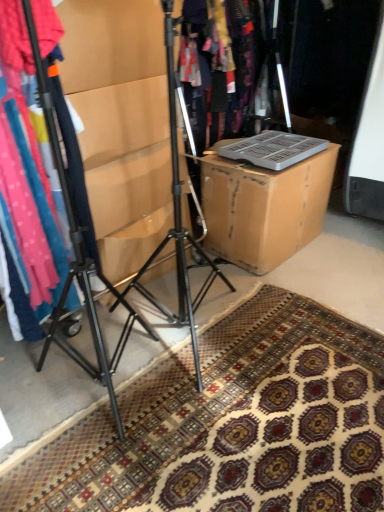
Question: Does point (279, 359) appear closer or farther from the camera than point (311, 165)?

Choices:
 (A) farther
 (B) closer

Answer: (B)

Question: From a real-world perspective, is patterned carpet at lower center positioned above or below brown cardboard box at center?

Choices:
 (A) below
 (B) above

Answer: (A)

Question: Which of these objects is positioned closest to the black metal tripod at center?

Choices:
 (A) matte cardboard box at center
 (B) patterned carpet at lower center
 (C) matte plastic laptop at center
 (D) brown cardboard box at center

Answer: (A)

Question: Based on their relative distances, which object is farther from the brown cardboard box at center?

Choices:
 (A) patterned carpet at lower center
 (B) black metal tripod at center
 (C) matte cardboard box at center
 (D) matte plastic laptop at center

Answer: (B)